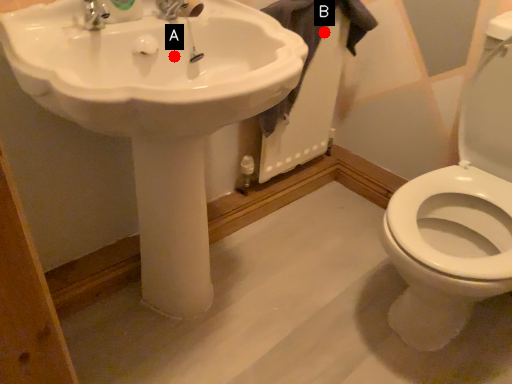
Question: Two points are circled on the image, labeled by A and B beside each circle. Which of the following is the farthest from the observer?

Choices:
 (A) A is further
 (B) B is further

Answer: (B)